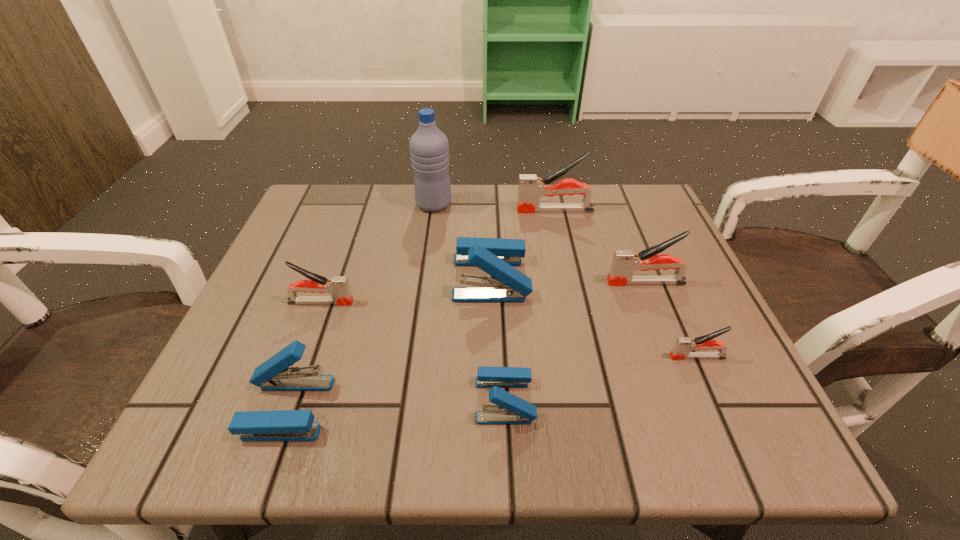
Locate an element on the screen. Image resolution: width=960 pixels, height=540 pixels. the sixth farthest object is located at coordinates (683, 345).

Find the location of a particular element. This screenshot has width=960, height=540. the smallest blue stapler is located at coordinates (509, 409).

This screenshot has height=540, width=960. What are the coordinates of `vacant space located on the right of the water bottle` in the screenshot? It's located at (571, 204).

Identify the location of vacant space situated on the handle side of the farthest stapler. (450, 210).

The height and width of the screenshot is (540, 960). I want to click on free location located on the handle side of the farthest stapler, so click(x=433, y=210).

Identify the location of vacant space located 0.050m on the handle side of the farthest stapler. (496, 210).

This screenshot has width=960, height=540. In order to click on vacant position located on the handle side of the third smallest gray stapler in this screenshot , I will do `click(532, 282)`.

You are a GUI agent. You are given a task and a screenshot of the screen. Output one action in this format:
    pyautogui.click(x=<x>, y=<y>)
    Task: Click on the free space located on the handle side of the third smallest gray stapler
    This screenshot has height=540, width=960.
    Given the screenshot: What is the action you would take?
    pyautogui.click(x=552, y=282)

This screenshot has width=960, height=540. Identify the location of vacant space situated on the handle side of the third smallest gray stapler. (547, 282).

The image size is (960, 540). Identify the location of free space located on the right of the farthest blue stapler. (695, 278).